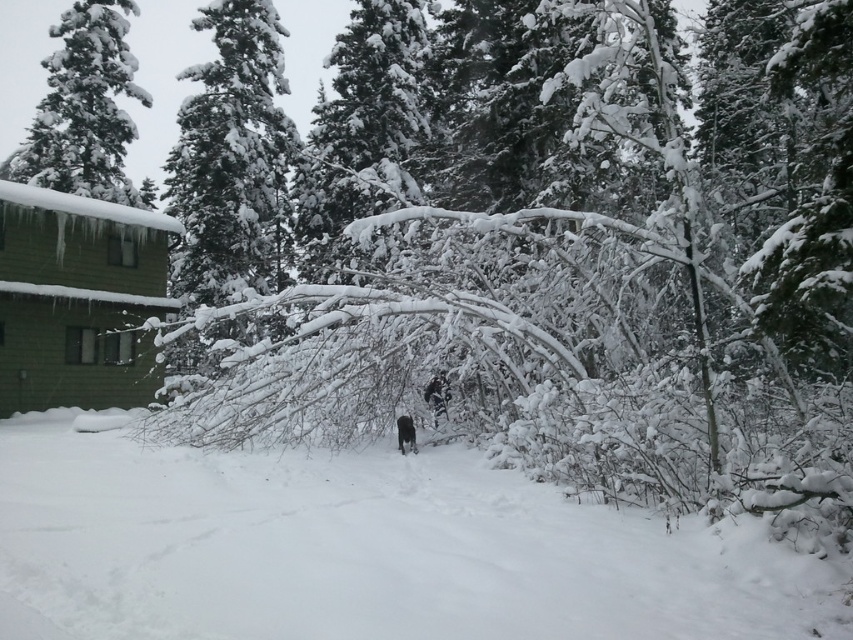
Question: Which point is farther to the camera?

Choices:
 (A) black fur coat at center
 (B) white fluffy snow at center
 (C) snow-covered pine tree at upper left

Answer: (C)

Question: Is snow-covered pine tree at upper left bigger than black fur coat at center?

Choices:
 (A) no
 (B) yes

Answer: (B)

Question: Is the position of snow-covered pine tree at upper left more distant than that of black fur coat at center?

Choices:
 (A) yes
 (B) no

Answer: (A)

Question: Is black fabric person at center closer to the viewer compared to black fur coat at center?

Choices:
 (A) yes
 (B) no

Answer: (B)

Question: Among these objects, which one is farthest from the camera?

Choices:
 (A) snow-covered pine tree at upper left
 (B) white fluffy snow at center

Answer: (A)

Question: Which object is the closest to the black fabric person at center?

Choices:
 (A) snow-covered pine tree at upper left
 (B) black fur coat at center
 (C) white fluffy snow at center

Answer: (B)